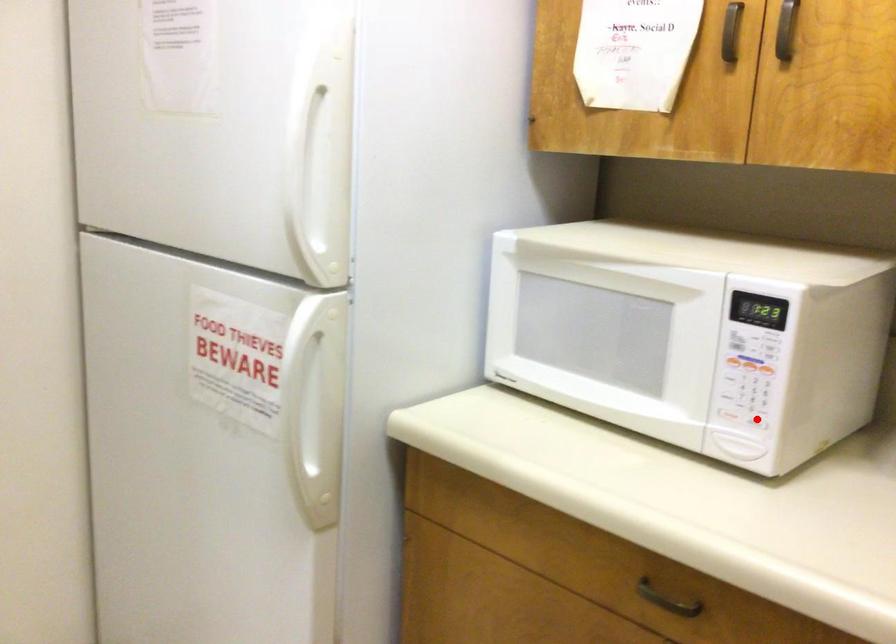
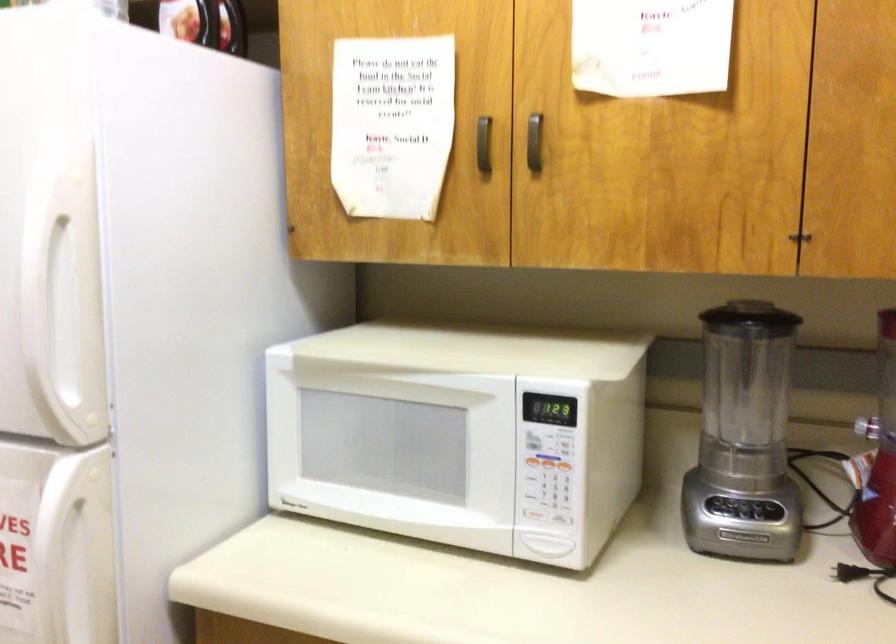
Find the pixel in the second image that matches the highlighted location in the first image.

(563, 518)